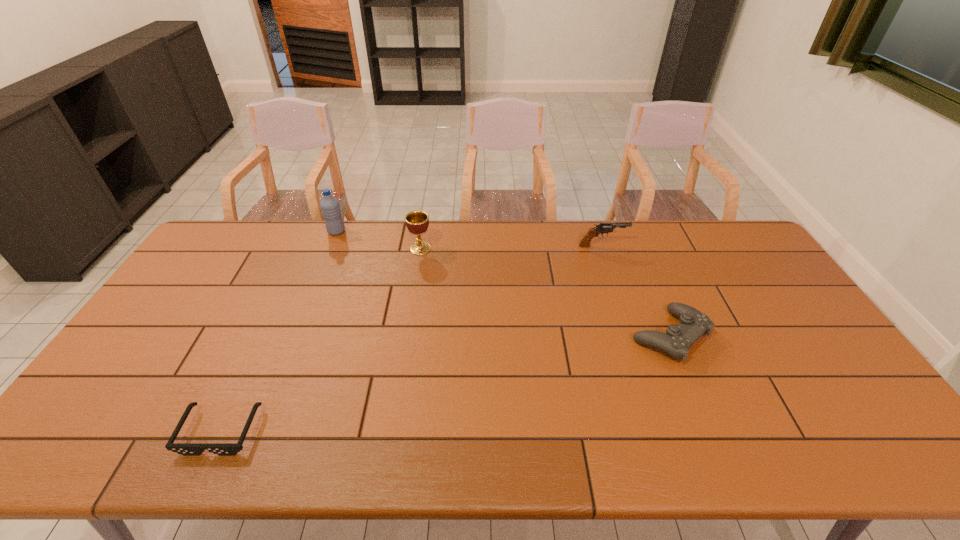
Find the location of `free space at the right edge of the desktop`. free space at the right edge of the desktop is located at coordinates tap(755, 295).

You are a GUI agent. You are given a task and a screenshot of the screen. Output one action in this format:
    pyautogui.click(x=<x>, y=<y>)
    Task: Click on the free spot at the far right corner of the desktop
    
    Given the screenshot: What is the action you would take?
    pyautogui.click(x=703, y=230)

At what (x,y) coordinates should I click in order to perform the action: click on vacant space in between the water bottle and the fourth farthest object. Please return your answer as a coordinate pair (x, y). The height and width of the screenshot is (540, 960). Looking at the image, I should click on (503, 284).

At what (x,y) coordinates should I click in order to perform the action: click on vacant region between the water bottle and the second nearest object. Please return your answer as a coordinate pair (x, y). Image resolution: width=960 pixels, height=540 pixels. Looking at the image, I should click on (503, 284).

Locate an element on the screen. This screenshot has height=540, width=960. empty space that is in between the control and the third tallest object is located at coordinates (636, 291).

Locate an element on the screen. blank region between the fourth shortest object and the nearest object is located at coordinates (321, 340).

At what (x,y) coordinates should I click in order to perform the action: click on free space that is in between the chalice and the gun. Please return your answer as a coordinate pair (x, y). The width and height of the screenshot is (960, 540). Looking at the image, I should click on (512, 247).

This screenshot has width=960, height=540. I want to click on vacant region between the gun and the second nearest object, so click(636, 291).

At what (x,y) coordinates should I click in order to perform the action: click on free space between the water bottle and the sunglasses. Please return your answer as a coordinate pair (x, y). The width and height of the screenshot is (960, 540). Looking at the image, I should click on (278, 331).

The height and width of the screenshot is (540, 960). In order to click on free space between the third object from right to left and the tallest object in this screenshot , I will do `click(378, 240)`.